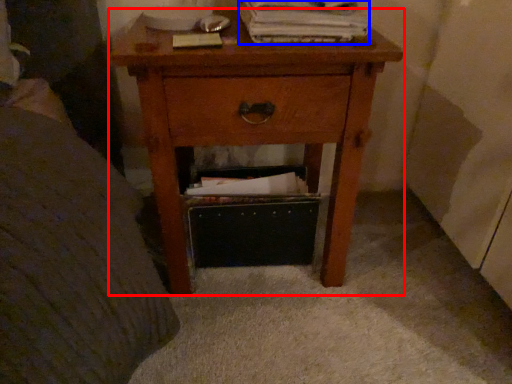
Question: Which of the following is the farthest to the observer, nightstand (highlighted by a red box) or paperback book (highlighted by a blue box)?

Choices:
 (A) nightstand
 (B) paperback book

Answer: (B)